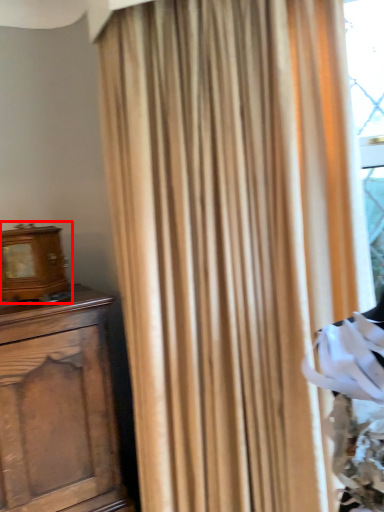
Question: From the image's perspective, what is the correct spatial relationship of alarm clock (annotated by the red box) in relation to curtain?

Choices:
 (A) below
 (B) above

Answer: (B)